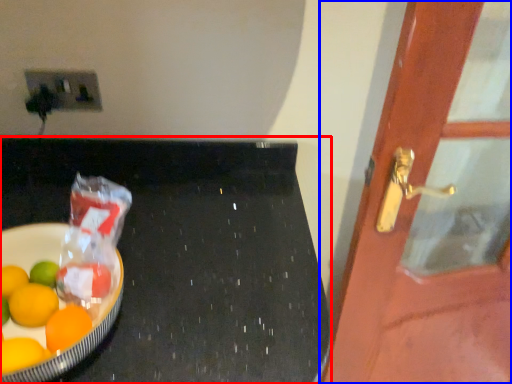
Question: Which object is further to the camera taking this photo, table (highlighted by a red box) or door (highlighted by a blue box)?

Choices:
 (A) table
 (B) door

Answer: (B)